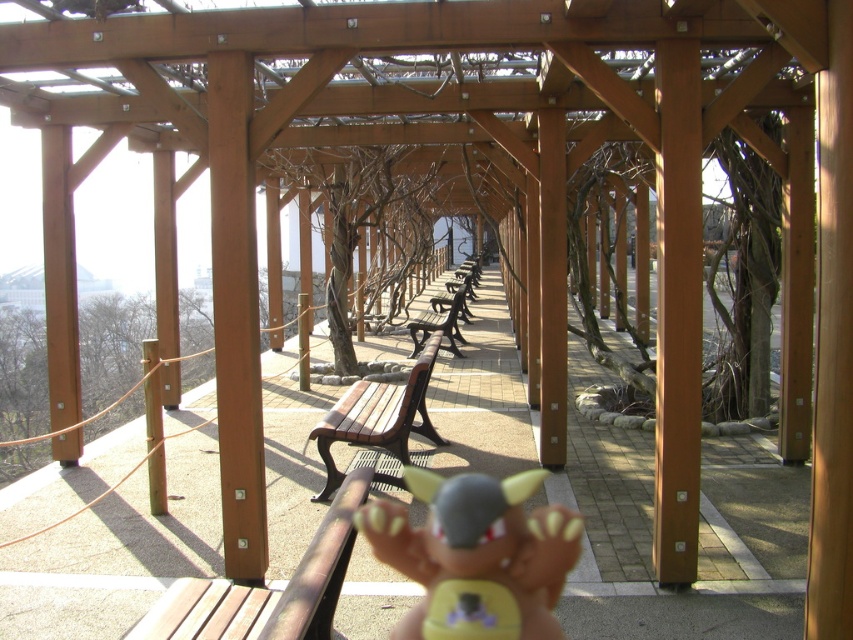
Who is shorter, brown textured tree at center or wooden bench at center?

Standing shorter between the two is wooden bench at center.

Measure the distance between brown textured tree at center and camera.

brown textured tree at center and camera are 9.18 meters apart from each other.

This screenshot has width=853, height=640. Identify the location of brown textured tree at center. (372, 227).

Is matte gray plush toy at center to the right of wooden bench at center from the viewer's perspective?

Yes, matte gray plush toy at center is to the right of wooden bench at center.

Who is lower down, matte gray plush toy at center or wooden bench at center?

matte gray plush toy at center

Is point (561, 545) closer to camera compared to point (386, 401)?

Yes, it is.

Find the location of a particular element. The width and height of the screenshot is (853, 640). matte gray plush toy at center is located at coordinates (477, 552).

Which of these two, brown wooden bench at lower center or wooden bench at center, stands taller?

wooden bench at center

Can you confirm if brown wooden bench at lower center is positioned above wooden bench at center?

No, brown wooden bench at lower center is not above wooden bench at center.

Image resolution: width=853 pixels, height=640 pixels. What are the coordinates of `brown wooden bench at lower center` in the screenshot? It's located at (267, 588).